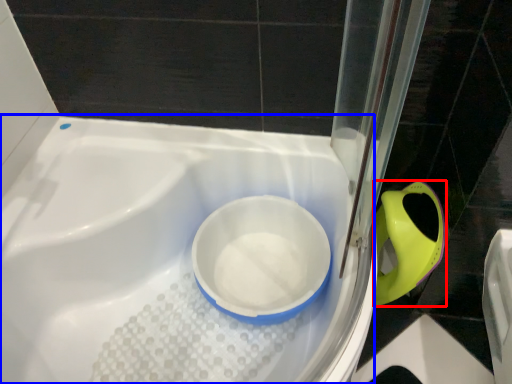
Question: Which of the following is the farthest to the observer, bidet (highlighted by a red box) or bath (highlighted by a blue box)?

Choices:
 (A) bidet
 (B) bath

Answer: (A)